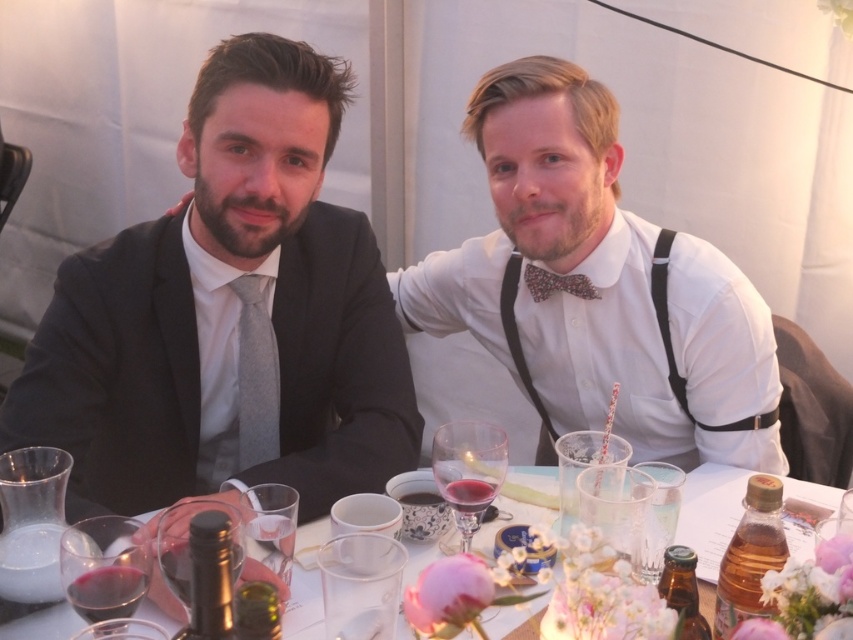
Question: In this image, where is matte black suit at left located relative to floral-patterned fabric bow tie at center?

Choices:
 (A) above
 (B) below

Answer: (B)

Question: In this image, where is translucent glass wine glass at lower left located relative to transparent glass wine glass at center?

Choices:
 (A) left
 (B) right

Answer: (A)

Question: Is translucent glass wine glass at lower left wider than transparent glass wine glass at center?

Choices:
 (A) no
 (B) yes

Answer: (B)

Question: Estimate the real-world distances between objects in this image. Which object is farther from the transparent glass wine glass at center?

Choices:
 (A) translucent glass vase at center
 (B) translucent glass wine glass at lower left

Answer: (B)

Question: Which of the following is the closest to the observer?

Choices:
 (A) (276, 436)
 (B) (96, 563)

Answer: (B)

Question: Among these objects, which one is nearest to the camera?

Choices:
 (A) floral-patterned fabric bow tie at center
 (B) translucent glass wine glass at lower left

Answer: (B)